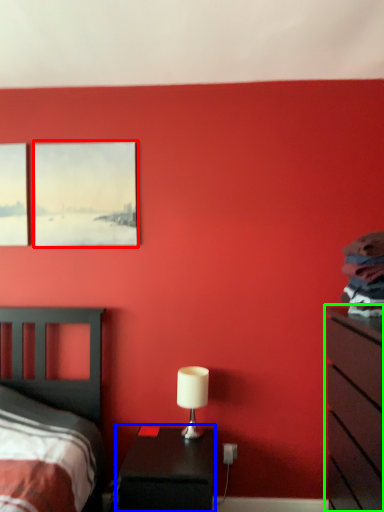
Question: Which is nearer to the picture frame (highlighted by a red box)? nightstand (highlighted by a blue box) or chest of drawers (highlighted by a green box).

Choices:
 (A) nightstand
 (B) chest of drawers

Answer: (A)